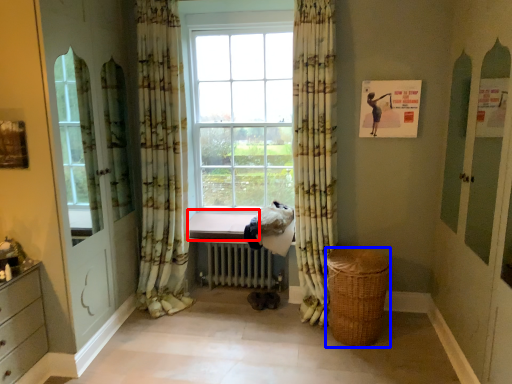
Question: Which object is further to the camera taking this photo, window sill (highlighted by a red box) or basket (highlighted by a blue box)?

Choices:
 (A) window sill
 (B) basket

Answer: (A)